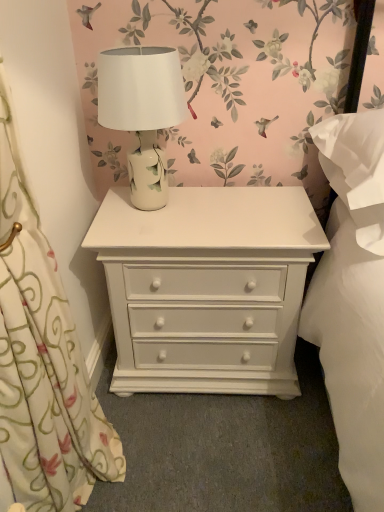
Question: From a real-world perspective, is white painted wood chest of drawers at center physically located above or below white ceramic table lamp at center?

Choices:
 (A) below
 (B) above

Answer: (A)

Question: Is point pos(119,350) closer or farther from the camera than point pos(162,105)?

Choices:
 (A) closer
 (B) farther

Answer: (B)

Question: Which of these objects is positioned closest to the white floral fabric at left?

Choices:
 (A) white painted wood chest of drawers at center
 (B) white ceramic table lamp at center

Answer: (A)

Question: Which object is the closest to the white ceramic table lamp at center?

Choices:
 (A) white painted wood chest of drawers at center
 (B) white floral fabric at left

Answer: (A)